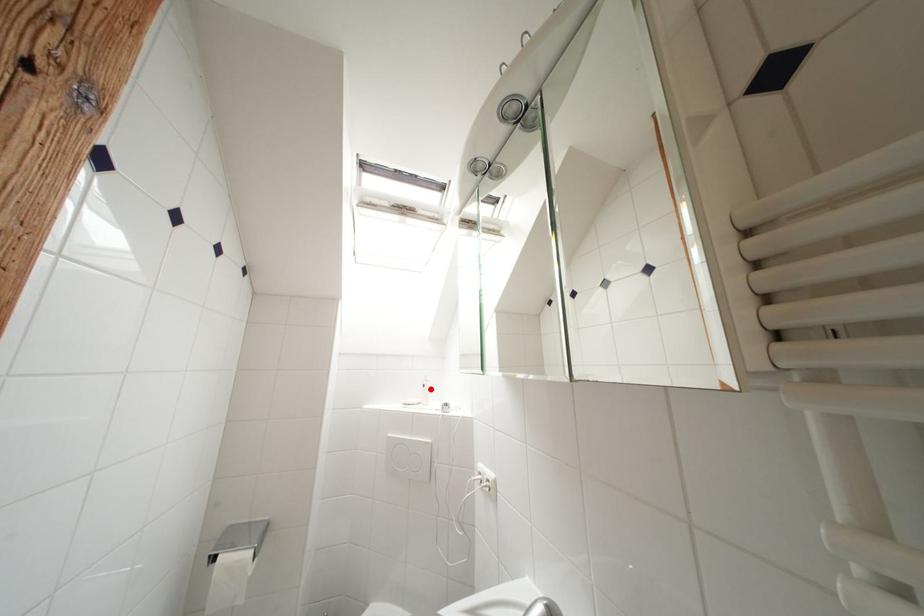
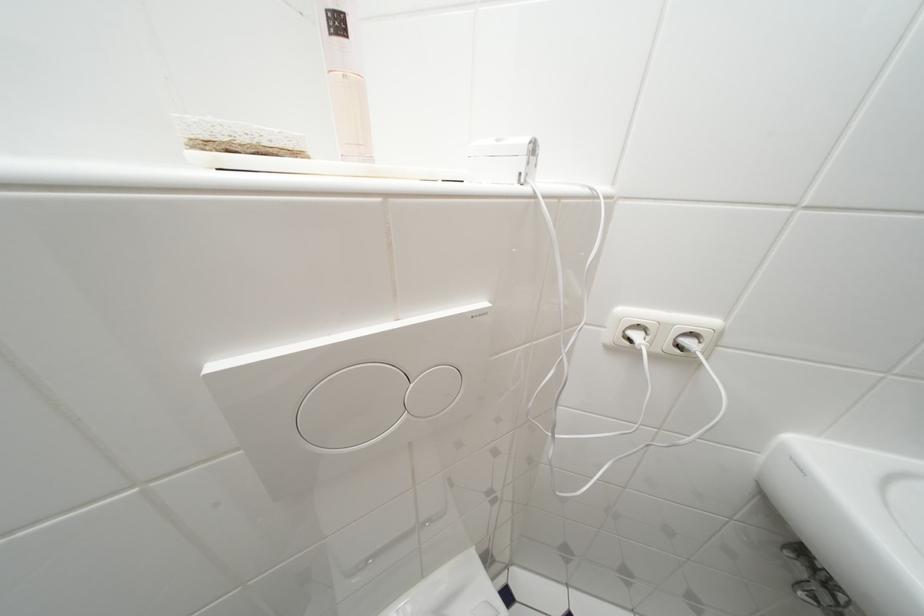
Locate, in the second image, the point that corresponds to the highlighted location in the first image.

(345, 26)